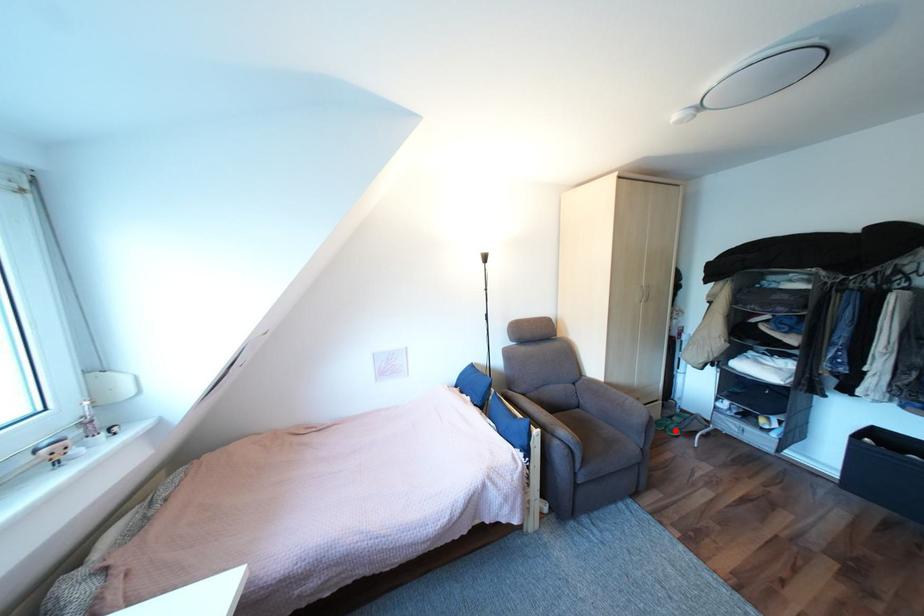
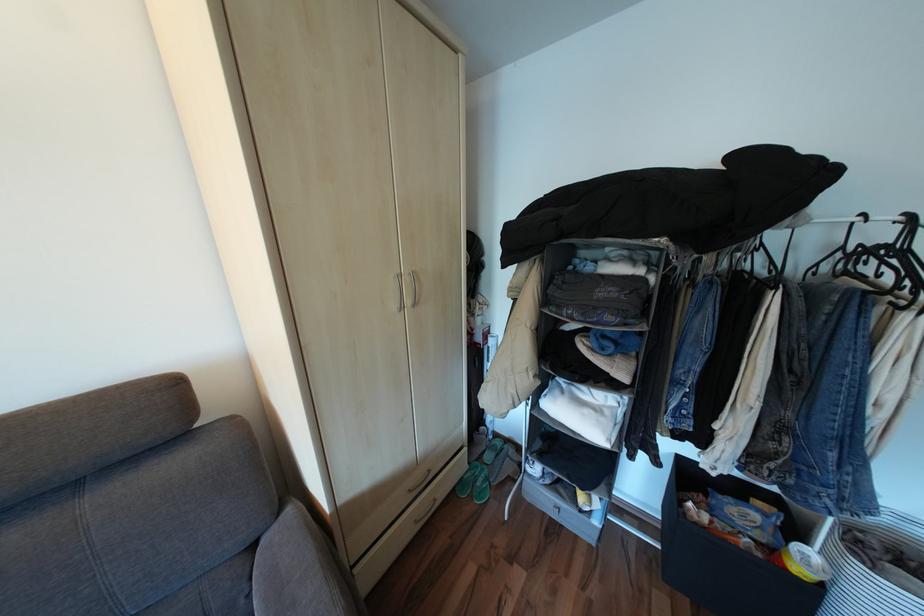
Find the pixel in the second image that matches the highlighted location in the first image.

(481, 496)